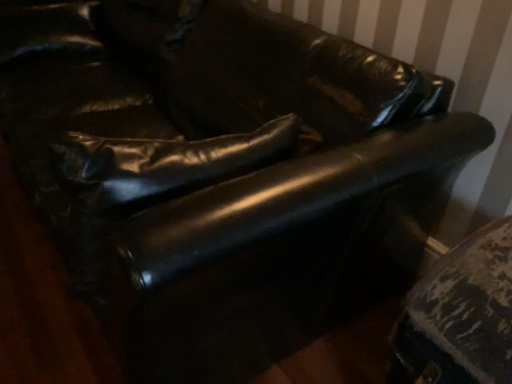
Find the location of a particular element. patterned fabric swivel chair at lower right is located at coordinates (462, 313).

What do you see at coordinates (462, 313) in the screenshot?
I see `patterned fabric swivel chair at lower right` at bounding box center [462, 313].

You are a GUI agent. You are given a task and a screenshot of the screen. Output one action in this format:
    pyautogui.click(x=<x>, y=<y>)
    Task: Click on the patterned fabric swivel chair at lower right
    The image size is (512, 384).
    Given the screenshot: What is the action you would take?
    pyautogui.click(x=462, y=313)